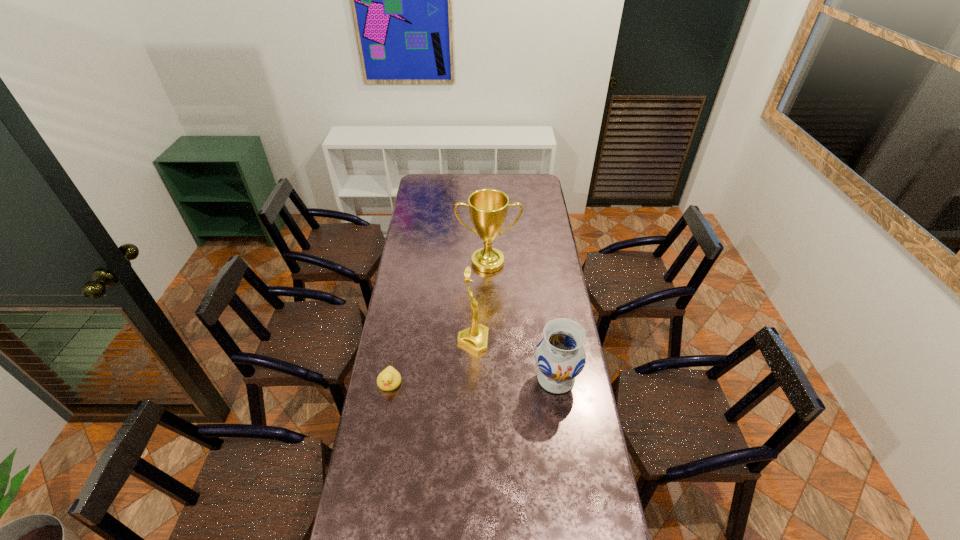
Where is `free space that satisfies the following two spatial constraints: 1. on the front-facing side of the nearer award; 2. on the face of the shortest object`? The height and width of the screenshot is (540, 960). free space that satisfies the following two spatial constraints: 1. on the front-facing side of the nearer award; 2. on the face of the shortest object is located at coordinates (472, 382).

Find the location of a particular element. free region that satisfies the following two spatial constraints: 1. by the handles of the farther award; 2. on the front-facing side of the nearer award is located at coordinates point(489,341).

At what (x,y) coordinates should I click in order to perform the action: click on free spot that satisfies the following two spatial constraints: 1. on the front-facing side of the nearer award; 2. on the face of the duckling. Please return your answer as a coordinate pair (x, y). The height and width of the screenshot is (540, 960). Looking at the image, I should click on (472, 382).

The height and width of the screenshot is (540, 960). What are the coordinates of `free location that satisfies the following two spatial constraints: 1. by the handles of the farther award; 2. on the front-facing side of the nearer award` in the screenshot? It's located at (489, 341).

Locate an element on the screen. The width and height of the screenshot is (960, 540). free region that satisfies the following two spatial constraints: 1. on the front-facing side of the second farthest object; 2. on the back side of the vase is located at coordinates (472, 379).

At what (x,y) coordinates should I click in order to perform the action: click on free spot that satisfies the following two spatial constraints: 1. on the front-facing side of the nearer award; 2. on the face of the duckling. Please return your answer as a coordinate pair (x, y). This screenshot has height=540, width=960. Looking at the image, I should click on (472, 382).

I want to click on free spot that satisfies the following two spatial constraints: 1. on the front-facing side of the rightmost object; 2. on the left side of the nearer award, so click(x=472, y=379).

This screenshot has height=540, width=960. Identify the location of vacant position in the image that satisfies the following two spatial constraints: 1. on the front-facing side of the third tallest object; 2. on the right side of the nearer award. (472, 379).

This screenshot has height=540, width=960. What are the coordinates of `free region that satisfies the following two spatial constraints: 1. by the handles of the farthest object; 2. on the front-facing side of the second farthest object` in the screenshot? It's located at (489, 341).

Where is `free space that satisfies the following two spatial constraints: 1. on the front-facing side of the second farthest object; 2. on the right side of the vase`? The width and height of the screenshot is (960, 540). free space that satisfies the following two spatial constraints: 1. on the front-facing side of the second farthest object; 2. on the right side of the vase is located at coordinates (472, 379).